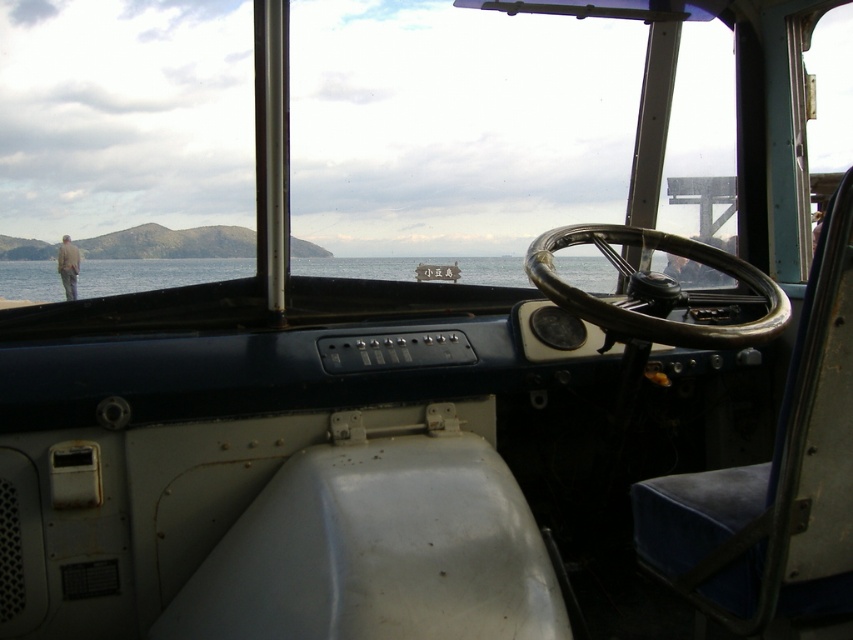
Is shiny chrome steering wheel at center bigger than light brown leather jacket at center?

Incorrect, shiny chrome steering wheel at center is not larger than light brown leather jacket at center.

Does shiny chrome steering wheel at center have a greater width compared to light brown leather jacket at center?

Yes.

Which is in front, point (635, 317) or point (62, 259)?

Point (635, 317) is in front.

Image resolution: width=853 pixels, height=640 pixels. Find the location of `shiny chrome steering wheel at center`. shiny chrome steering wheel at center is located at coordinates (660, 291).

Between shiny chrome steering wheel at center and wooden signboard at center, which one has more height?

shiny chrome steering wheel at center is taller.

Who is positioned more to the left, shiny chrome steering wheel at center or wooden signboard at center?

wooden signboard at center is more to the left.

What do you see at coordinates (660, 291) in the screenshot? The width and height of the screenshot is (853, 640). I see `shiny chrome steering wheel at center` at bounding box center [660, 291].

I want to click on shiny chrome steering wheel at center, so click(x=660, y=291).

Is light brown leather jacket at center positioned in front of wooden signboard at center?

No, it is behind wooden signboard at center.

Is the position of light brown leather jacket at center more distant than that of wooden signboard at center?

Yes, it is.

Is point (57, 253) behind point (418, 273)?

Yes, point (57, 253) is behind point (418, 273).

You are a GUI agent. You are given a task and a screenshot of the screen. Output one action in this format:
    pyautogui.click(x=<x>, y=<y>)
    Task: Click on the light brown leather jacket at center
    
    Given the screenshot: What is the action you would take?
    pyautogui.click(x=68, y=266)